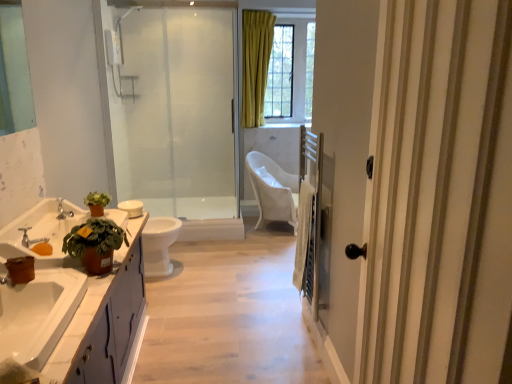
Locate an element on the screen. The width and height of the screenshot is (512, 384). free space behind white glossy cabinet at lower left is located at coordinates (176, 314).